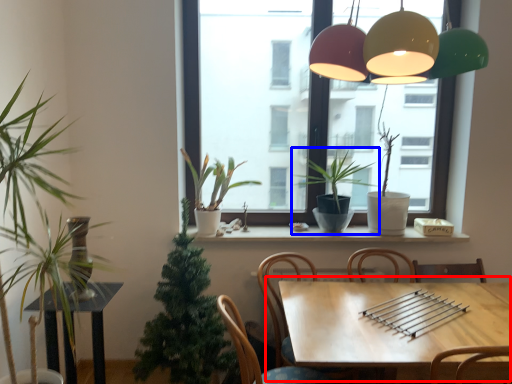
Question: Among these objects, which one is nearest to the camera, table (highlighted by a red box) or houseplant (highlighted by a blue box)?

Choices:
 (A) table
 (B) houseplant

Answer: (A)